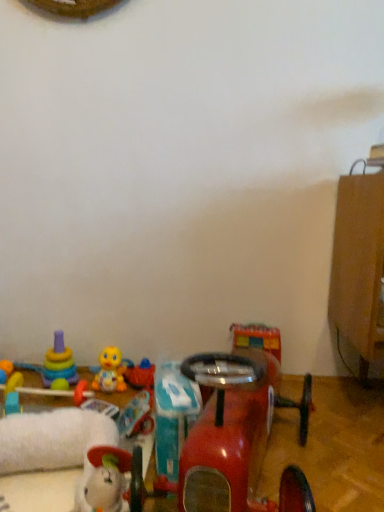
Question: From the image's perspective, is matte yellow toy at lower left, the seventh toy from the right, on top of glossy plastic toy car at lower center, marked as the first toy in a right-to-left arrangement?

Choices:
 (A) no
 (B) yes

Answer: (B)

Question: Does matte yellow toy at lower left, the seventh toy from the right, have a greater height compared to glossy plastic toy car at lower center, marked as the first toy in a right-to-left arrangement?

Choices:
 (A) yes
 (B) no

Answer: (B)

Question: Does matte yellow toy at lower left, which is the 1th toy from left to right, have a lesser height compared to glossy plastic toy car at lower center, marked as the first toy in a right-to-left arrangement?

Choices:
 (A) no
 (B) yes

Answer: (B)

Question: From the image's perspective, is matte yellow toy at lower left, which is the 1th toy from left to right, under glossy plastic toy car at lower center, which is counted as the seventh toy, starting from the left?

Choices:
 (A) no
 (B) yes

Answer: (A)

Question: Is matte yellow toy at lower left, the seventh toy from the right, at the left side of glossy plastic toy car at lower center, which is counted as the seventh toy, starting from the left?

Choices:
 (A) no
 (B) yes

Answer: (B)

Question: Is teal plastic toy at center, marked as the 2th toy in a right-to-left arrangement, wider or thinner than matte yellow toy at lower left, which is the 1th toy from left to right?

Choices:
 (A) wide
 (B) thin

Answer: (A)

Question: Would you say teal plastic toy at center, marked as the 2th toy in a right-to-left arrangement, is to the left or to the right of matte yellow toy at lower left, which is the 1th toy from left to right, in the picture?

Choices:
 (A) right
 (B) left

Answer: (A)

Question: Considering the positions of teal plastic toy at center, the 6th toy from the left, and matte yellow toy at lower left, the seventh toy from the right, in the image, is teal plastic toy at center, the 6th toy from the left, taller or shorter than matte yellow toy at lower left, the seventh toy from the right,?

Choices:
 (A) tall
 (B) short

Answer: (A)

Question: Considering their positions, is teal plastic toy at center, marked as the 2th toy in a right-to-left arrangement, located in front of or behind matte yellow toy at lower left, the seventh toy from the right?

Choices:
 (A) front
 (B) behind

Answer: (A)

Question: From the image's perspective, is stacked plastic rings at lower left, placed as the 2th toy when sorted from left to right, positioned above or below yellow rubber duck at center, placed as the fourth toy when sorted from left to right?

Choices:
 (A) below
 (B) above

Answer: (B)

Question: Is stacked plastic rings at lower left, marked as the sixth toy in a right-to-left arrangement, inside or outside of yellow rubber duck at center, placed as the fourth toy when sorted from left to right?

Choices:
 (A) inside
 (B) outside

Answer: (B)

Question: In the image, is stacked plastic rings at lower left, placed as the 2th toy when sorted from left to right, positioned in front of or behind yellow rubber duck at center, positioned as the 4th toy in right-to-left order?

Choices:
 (A) behind
 (B) front

Answer: (A)

Question: Considering the positions of point click(23, 367) and point click(114, 370), is point click(23, 367) closer or farther from the camera than point click(114, 370)?

Choices:
 (A) farther
 (B) closer

Answer: (A)

Question: Looking at their shapes, would you say matte yellow toy at lower left, the seventh toy from the right, is wider or thinner than teal plastic toy at center, the 6th toy from the left?

Choices:
 (A) wide
 (B) thin

Answer: (B)

Question: Considering their positions, is matte yellow toy at lower left, the seventh toy from the right, located in front of or behind teal plastic toy at center, the 6th toy from the left?

Choices:
 (A) front
 (B) behind

Answer: (B)